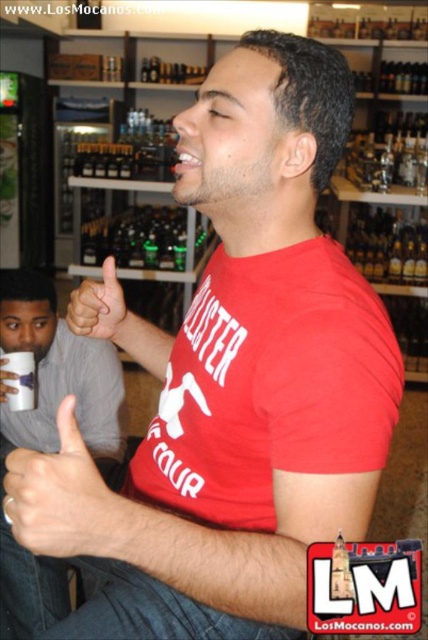
What is the color of the fabric at the point with coordinates (x=58, y=372)?

The gray fabric shirt at left is located at point (x=58, y=372).

In the scene shown: You are a customer in the store and see the gray fabric shirt at left and the matte red thumb at center. Which object is positioned more to the left side of the image?

The gray fabric shirt at left is positioned more to the left side of the image than the matte red thumb at center.

From the picture: You are a customer looking at the gray fabric shirt at left and the skinny metallic ring at upper center in the store. Which item takes up more space visually?

The gray fabric shirt at left has a larger size compared to the skinny metallic ring at upper center, so it takes up more visual space.